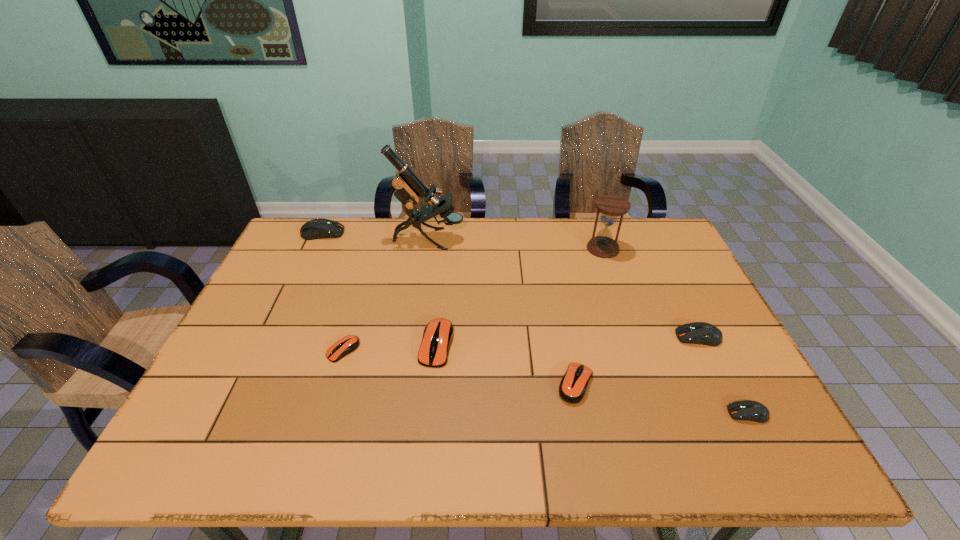
Locate an element on the screen. microscope is located at coordinates (409, 187).

The image size is (960, 540). I want to click on the seventh shortest object, so (x=611, y=206).

This screenshot has height=540, width=960. I want to click on hourglass, so click(x=611, y=206).

The height and width of the screenshot is (540, 960). I want to click on the farthest computer mouse, so click(320, 228).

At what (x,y) coordinates should I click in order to perform the action: click on the farthest dark computer equipment. Please return your answer as a coordinate pair (x, y). Looking at the image, I should click on (320, 228).

I want to click on the fourth computer mouse from right to left, so click(438, 334).

At what (x,y) coordinates should I click in order to perform the action: click on the second orange computer mouse from right to left. Please return your answer as a coordinate pair (x, y). The height and width of the screenshot is (540, 960). Looking at the image, I should click on (438, 334).

Find the location of `the second biggest dark computer equipment`. the second biggest dark computer equipment is located at coordinates (703, 333).

This screenshot has width=960, height=540. In order to click on the third computer mouse from right to left in this screenshot , I will do `click(573, 385)`.

Image resolution: width=960 pixels, height=540 pixels. Find the location of `the rightmost orange computer mouse`. the rightmost orange computer mouse is located at coordinates (573, 385).